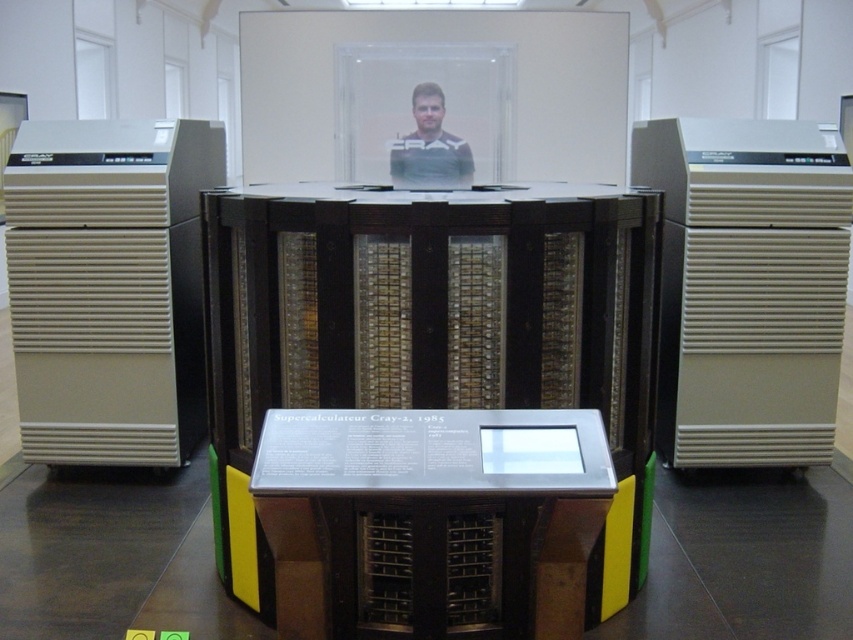
You are a museum visitor standing in front of the wooden paneling supercomputer at center and the light brown leather jacket at center. Which object is wider?

The wooden paneling supercomputer at center is wider than the light brown leather jacket at center.

You are standing in front of the Cray supercomputer and want to take a photo of the display stand with your phone. Your phone has a 12MP camera with a 0.5x optical zoom. The display stand is at point [236,531]. The Cray supercomputer is behind the display stand. Can you focus on the display stand without the supercomputer being in the background?

The distance between point [236,531] and the camera is 8.34 feet. Since the display stand is closer to you than the Cray supercomputer, which is behind it, your phone should be able to focus on the display stand while keeping the supercomputer blurred in the background.